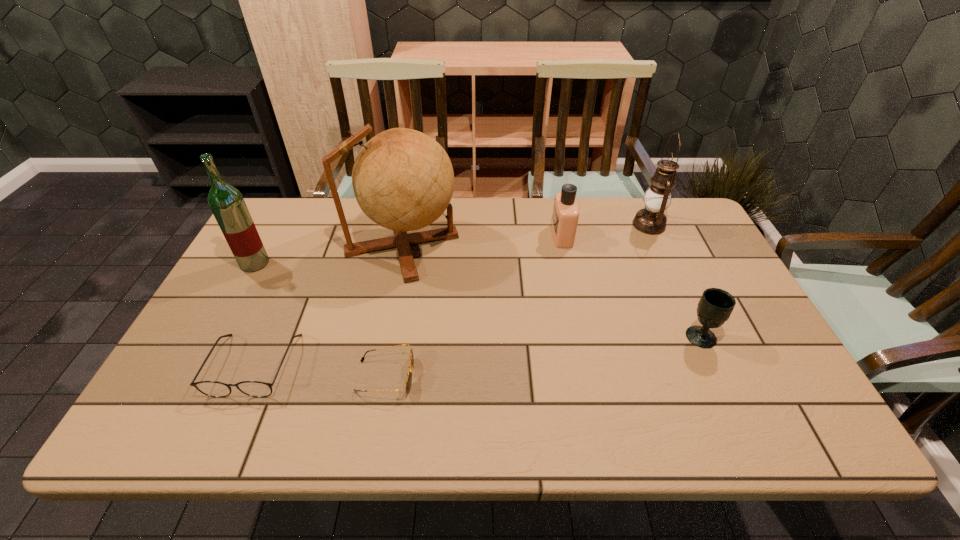
Where is `free space at the far right corner of the desktop`? free space at the far right corner of the desktop is located at coordinates (690, 223).

Locate an element on the screen. The image size is (960, 540). free space between the globe and the fifth object from left to right is located at coordinates (482, 240).

At what (x,y) coordinates should I click in order to perform the action: click on unoccupied position between the liquor and the oil lamp. Please return your answer as a coordinate pair (x, y). The width and height of the screenshot is (960, 540). Looking at the image, I should click on (452, 244).

Locate an element on the screen. The width and height of the screenshot is (960, 540). free space between the chalice and the perfume is located at coordinates (632, 286).

Locate an element on the screen. vacant point located between the liquor and the shortest object is located at coordinates (321, 320).

You are a GUI agent. You are given a task and a screenshot of the screen. Output one action in this format:
    pyautogui.click(x=<x>, y=<y>)
    Task: Click on the vacant space in between the third object from right to left and the spectacles
    The image size is (960, 540).
    Given the screenshot: What is the action you would take?
    pyautogui.click(x=408, y=300)

You are a GUI agent. You are given a task and a screenshot of the screen. Output one action in this format:
    pyautogui.click(x=<x>, y=<y>)
    Task: Click on the vacant space that is in between the globe and the liquor
    This screenshot has width=960, height=540.
    Given the screenshot: What is the action you would take?
    pyautogui.click(x=328, y=254)

Identify the location of free spot between the spectacles and the fifth object from left to right. The width and height of the screenshot is (960, 540). (408, 300).

Image resolution: width=960 pixels, height=540 pixels. Identify the location of vacant area between the second object from left to right and the globe. (328, 305).

The image size is (960, 540). What are the coordinates of `free space between the spectacles and the fifth tallest object` in the screenshot? It's located at (477, 350).